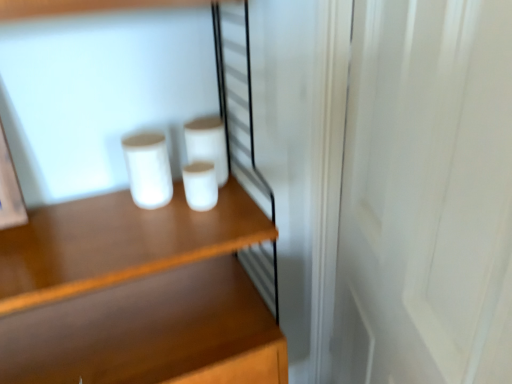
What is the approximate height of wooden shelf at center?

It is 4.63 feet.

You are a GUI agent. You are given a task and a screenshot of the screen. Output one action in this format:
    pyautogui.click(x=<x>, y=<y>)
    Task: Click on the white matte cup at center, the 3th paper towel positioned from the right
    This screenshot has width=512, height=384.
    Given the screenshot: What is the action you would take?
    148,169

The height and width of the screenshot is (384, 512). Describe the element at coordinates (426, 195) in the screenshot. I see `white wood screen door at right` at that location.

The image size is (512, 384). Describe the element at coordinates (208, 144) in the screenshot. I see `white matte paper towel at center, positioned as the 2th paper towel in right-to-left order` at that location.

Identify the location of wooden shelf at center. This screenshot has height=384, width=512. (154, 334).

Does wooden shelf at center lie behind white wood screen door at right?

Yes.

Considering the relative sizes of wooden shelf at center and white wood screen door at right in the image provided, is wooden shelf at center thinner than white wood screen door at right?

Correct, the width of wooden shelf at center is less than that of white wood screen door at right.

Considering the positions of objects wooden shelf at center and white wood screen door at right in the image provided, who is more to the right, wooden shelf at center or white wood screen door at right?

From the viewer's perspective, white wood screen door at right appears more on the right side.

Is wooden shelf at center oriented towards white wood screen door at right?

Yes, wooden shelf at center is turned towards white wood screen door at right.

Is white wood screen door at right far away from wooden shelf at center?

No, white wood screen door at right is not far from wooden shelf at center.

Who is bigger, white wood screen door at right or wooden shelf at center?

With larger size is white wood screen door at right.

Does white wood screen door at right have a greater width compared to wooden shelf at center?

Correct, the width of white wood screen door at right exceeds that of wooden shelf at center.

From the image's perspective, is white wood screen door at right under wooden shelf at center?

Actually, white wood screen door at right appears above wooden shelf at center in the image.

Which is more to the left, white matte cup at center, acting as the 1th paper towel starting from the left, or white matte cup at center, arranged as the 1th paper towel when viewed from the right?

white matte cup at center, acting as the 1th paper towel starting from the left, is more to the left.

Is there a large distance between white matte cup at center, the 3th paper towel positioned from the right, and white matte cup at center, which appears as the 3th paper towel when viewed from the left?

white matte cup at center, the 3th paper towel positioned from the right, is near white matte cup at center, which appears as the 3th paper towel when viewed from the left, not far away.

Could you tell me if white matte cup at center, acting as the 1th paper towel starting from the left, is turned towards white matte cup at center, arranged as the 1th paper towel when viewed from the right?

No, white matte cup at center, acting as the 1th paper towel starting from the left, is not aimed at white matte cup at center, arranged as the 1th paper towel when viewed from the right.

Is white matte cup at center, the 3th paper towel positioned from the right, positioned behind white matte cup at center, arranged as the 1th paper towel when viewed from the right?

No, it is not.

Which is more to the left, white matte paper towel at center, positioned as the 2th paper towel in right-to-left order, or white matte cup at center, the 3th paper towel positioned from the right?

white matte cup at center, the 3th paper towel positioned from the right.

Who is smaller, white matte paper towel at center, the second paper towel from the left, or white matte cup at center, the 3th paper towel positioned from the right?

white matte cup at center, the 3th paper towel positioned from the right, is smaller.

From a real-world perspective, which is physically below, white matte paper towel at center, positioned as the 2th paper towel in right-to-left order, or white matte cup at center, acting as the 1th paper towel starting from the left?

In real-world perspective, white matte paper towel at center, positioned as the 2th paper towel in right-to-left order, is lower.

Would you consider white matte paper towel at center, the second paper towel from the left, to be distant from white matte cup at center, arranged as the 1th paper towel when viewed from the right?

No, white matte paper towel at center, the second paper towel from the left, is not far away from white matte cup at center, arranged as the 1th paper towel when viewed from the right.

Between white matte paper towel at center, the second paper towel from the left, and white matte cup at center, arranged as the 1th paper towel when viewed from the right, which one appears on the right side from the viewer's perspective?

white matte cup at center, arranged as the 1th paper towel when viewed from the right.

From a real-world perspective, which paper towel is the 1st one above the white matte cup at center, which appears as the 3th paper towel when viewed from the left? Please provide its 2D coordinates.

[(208, 144)]

Considering the sizes of objects white matte cup at center, which appears as the 3th paper towel when viewed from the left, and white matte cup at center, acting as the 1th paper towel starting from the left, in the image provided, who is shorter, white matte cup at center, which appears as the 3th paper towel when viewed from the left, or white matte cup at center, acting as the 1th paper towel starting from the left,?

With less height is white matte cup at center, which appears as the 3th paper towel when viewed from the left.

Considering the positions of points (201, 185) and (161, 175), is point (201, 185) closer to camera compared to point (161, 175)?

Yes, point (201, 185) is closer to viewer.

Is white matte cup at center, arranged as the 1th paper towel when viewed from the right, wider or thinner than white matte cup at center, acting as the 1th paper towel starting from the left?

In the image, white matte cup at center, arranged as the 1th paper towel when viewed from the right, appears to be more narrow than white matte cup at center, acting as the 1th paper towel starting from the left.

Would you say wooden shelf at center is a long distance from white matte paper towel at center, positioned as the 2th paper towel in right-to-left order?

No, wooden shelf at center is not far away from white matte paper towel at center, positioned as the 2th paper towel in right-to-left order.

From the image's perspective, which is above, wooden shelf at center or white matte paper towel at center, positioned as the 2th paper towel in right-to-left order?

white matte paper towel at center, positioned as the 2th paper towel in right-to-left order, from the image's perspective.

From a real-world perspective, is wooden shelf at center below white matte paper towel at center, the second paper towel from the left?

Yes, from a real-world perspective, wooden shelf at center is under white matte paper towel at center, the second paper towel from the left.

Looking at the image, does wooden shelf at center seem bigger or smaller compared to white matte paper towel at center, the second paper towel from the left?

Clearly, wooden shelf at center is larger in size than white matte paper towel at center, the second paper towel from the left.

Find the location of a particular element. The width and height of the screenshot is (512, 384). shelf behind the white wood screen door at right is located at coordinates (154, 334).

Find the location of a particular element. screen door above the wooden shelf at center (from a real-world perspective) is located at coordinates point(426,195).

From the picture: Based on their spatial positions, is white matte paper towel at center, the second paper towel from the left, or white matte cup at center, the 3th paper towel positioned from the right, closer to wooden shelf at center?

white matte cup at center, the 3th paper towel positioned from the right, is positioned closer to the anchor wooden shelf at center.

When comparing their distances from white matte cup at center, which appears as the 3th paper towel when viewed from the left, does white matte paper towel at center, positioned as the 2th paper towel in right-to-left order, or wooden shelf at center seem further?

Based on the image, wooden shelf at center appears to be further to white matte cup at center, which appears as the 3th paper towel when viewed from the left.

Based on their spatial positions, is white wood screen door at right or white matte cup at center, arranged as the 1th paper towel when viewed from the right, closer to wooden shelf at center?

white matte cup at center, arranged as the 1th paper towel when viewed from the right, is positioned closer to the anchor wooden shelf at center.

Based on the photo, looking at the image, which one is located closer to white matte cup at center, acting as the 1th paper towel starting from the left, wooden shelf at center or white matte paper towel at center, positioned as the 2th paper towel in right-to-left order?

white matte paper towel at center, positioned as the 2th paper towel in right-to-left order, is closer to white matte cup at center, acting as the 1th paper towel starting from the left.

Based on their spatial positions, is white matte paper towel at center, positioned as the 2th paper towel in right-to-left order, or wooden shelf at center closer to white wood screen door at right?

Result: Based on the image, white matte paper towel at center, positioned as the 2th paper towel in right-to-left order, appears to be nearer to white wood screen door at right.

Looking at the image, which one is located closer to white matte cup at center, which appears as the 3th paper towel when viewed from the left, white wood screen door at right or white matte cup at center, the 3th paper towel positioned from the right?

white matte cup at center, the 3th paper towel positioned from the right, is closer to white matte cup at center, which appears as the 3th paper towel when viewed from the left.

Considering their positions, is white matte cup at center, acting as the 1th paper towel starting from the left, positioned closer to wooden shelf at center than white matte cup at center, arranged as the 1th paper towel when viewed from the right?

white matte cup at center, acting as the 1th paper towel starting from the left, is positioned closer to the anchor wooden shelf at center.

Looking at the image, which one is located further to white matte cup at center, acting as the 1th paper towel starting from the left, wooden shelf at center or white wood screen door at right?

The object further to white matte cup at center, acting as the 1th paper towel starting from the left, is white wood screen door at right.

Find the location of `paper towel between white matte cup at center, the 3th paper towel positioned from the right, and wooden shelf at center from top to bottom`. paper towel between white matte cup at center, the 3th paper towel positioned from the right, and wooden shelf at center from top to bottom is located at coordinates (200, 185).

The height and width of the screenshot is (384, 512). Find the location of `shelf between white matte cup at center, acting as the 1th paper towel starting from the left, and white wood screen door at right`. shelf between white matte cup at center, acting as the 1th paper towel starting from the left, and white wood screen door at right is located at coordinates (154, 334).

Find the location of a particular element. Image resolution: width=512 pixels, height=384 pixels. paper towel located between white matte paper towel at center, the second paper towel from the left, and white wood screen door at right in the left-right direction is located at coordinates (200, 185).

Where is `paper towel between white matte cup at center, the 3th paper towel positioned from the right, and white matte cup at center, arranged as the 1th paper towel when viewed from the right, in the horizontal direction`? paper towel between white matte cup at center, the 3th paper towel positioned from the right, and white matte cup at center, arranged as the 1th paper towel when viewed from the right, in the horizontal direction is located at coordinates (208, 144).